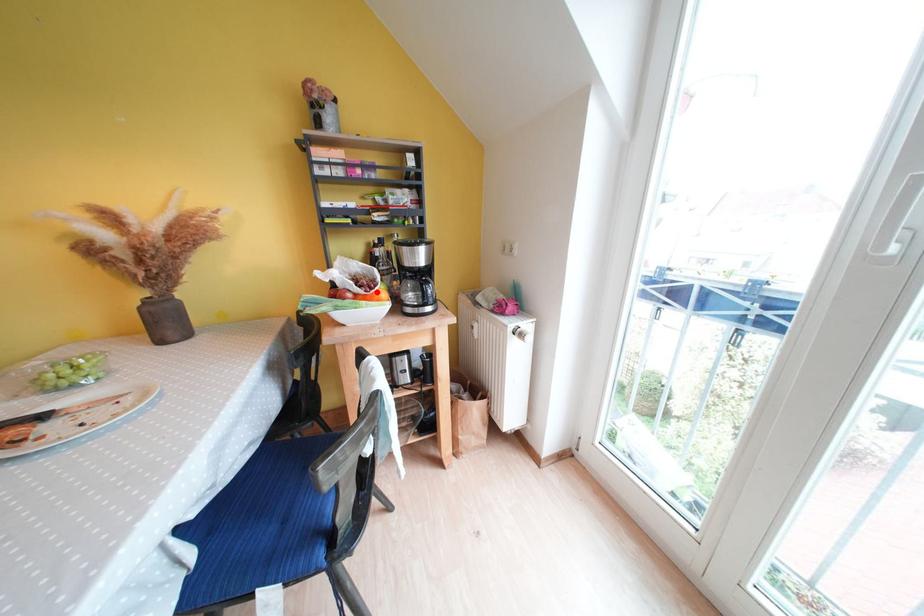
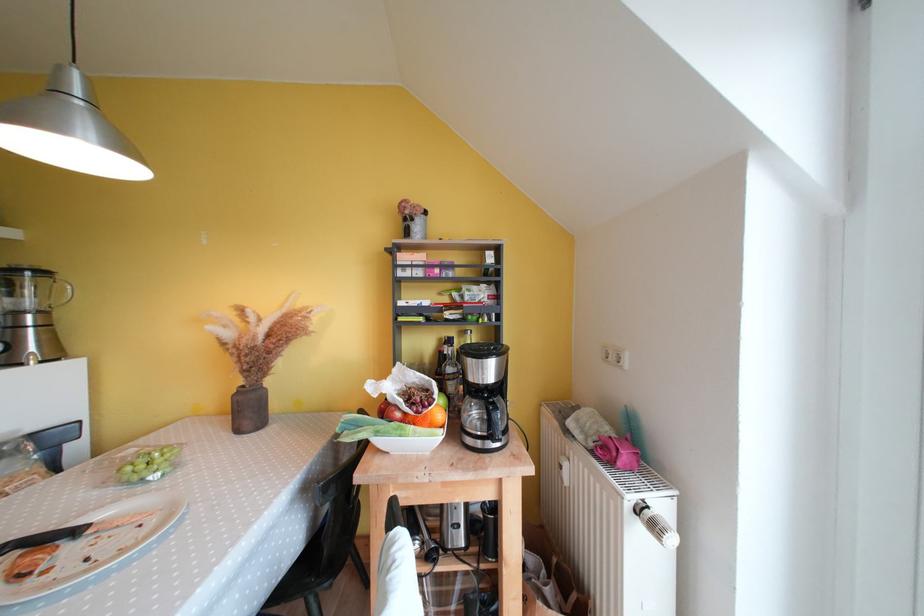
Question: I am providing you with two images of the same scene from different viewpoints. Image1 has a red point marked. In image2, the corresponding 3D location appears at what relative position? Reply with the corresponding letter.

Choices:
 (A) Closer
 (B) Farther

Answer: (B)